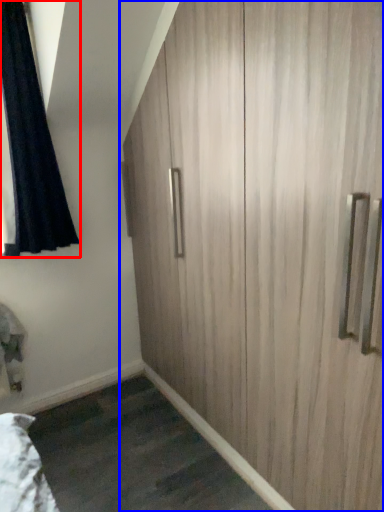
Question: Which point is further to the camera, curtain (highlighted by a red box) or cupboard (highlighted by a blue box)?

Choices:
 (A) curtain
 (B) cupboard

Answer: (A)